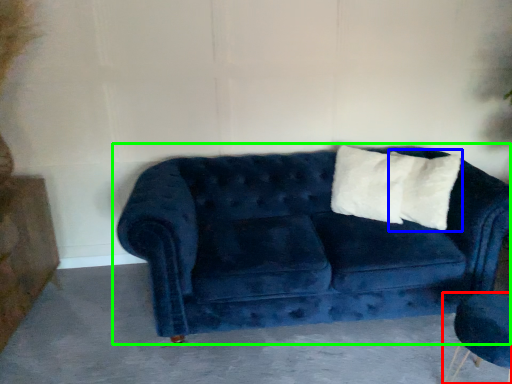
Question: Which object is positioned farthest from armchair (highlighted by a red box)? Select from pillow (highlighted by a blue box) and studio couch (highlighted by a green box).

Choices:
 (A) pillow
 (B) studio couch

Answer: (B)